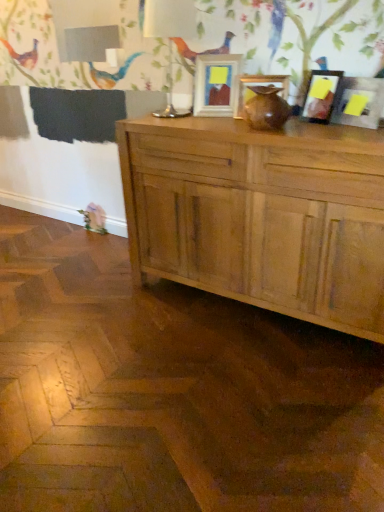
Question: Is point (345, 103) closer or farther from the camera than point (170, 10)?

Choices:
 (A) closer
 (B) farther

Answer: (A)

Question: From a real-world perspective, is matte black picture frame at upper right, the fourth picture frame positioned from the left, above or below white glossy table lamp at upper center?

Choices:
 (A) above
 (B) below

Answer: (B)

Question: Estimate the real-world distances between objects in this image. Which object is farther from the matte black picture frame at upper right, which ranks as the first picture frame in right-to-left order?

Choices:
 (A) matte wooden picture frame at center, arranged as the 1th picture frame when viewed from the left
 (B) natural wood cabinet at center
 (C) matte wooden picture frame at center, acting as the 2th picture frame starting from the left
 (D) matte black picture frame at upper right, placed as the 2th picture frame when sorted from right to left
 (E) white glossy table lamp at upper center

Answer: (E)

Question: Which is nearer to the matte black picture frame at upper right, which ranks as the first picture frame in right-to-left order?

Choices:
 (A) natural wood cabinet at center
 (B) matte black picture frame at upper right, placed as the 3th picture frame when sorted from left to right
 (C) matte wooden picture frame at center, arranged as the 1th picture frame when viewed from the left
 (D) matte wooden picture frame at center, which appears as the 3th picture frame when viewed from the right
 (E) white glossy table lamp at upper center

Answer: (B)